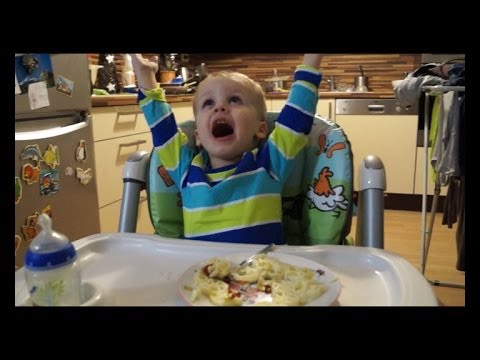
At what (x,y) coordinates should I click in order to perform the action: click on messy food plate. Please return your answer as a coordinate pair (x, y). Looking at the image, I should click on (318, 273).